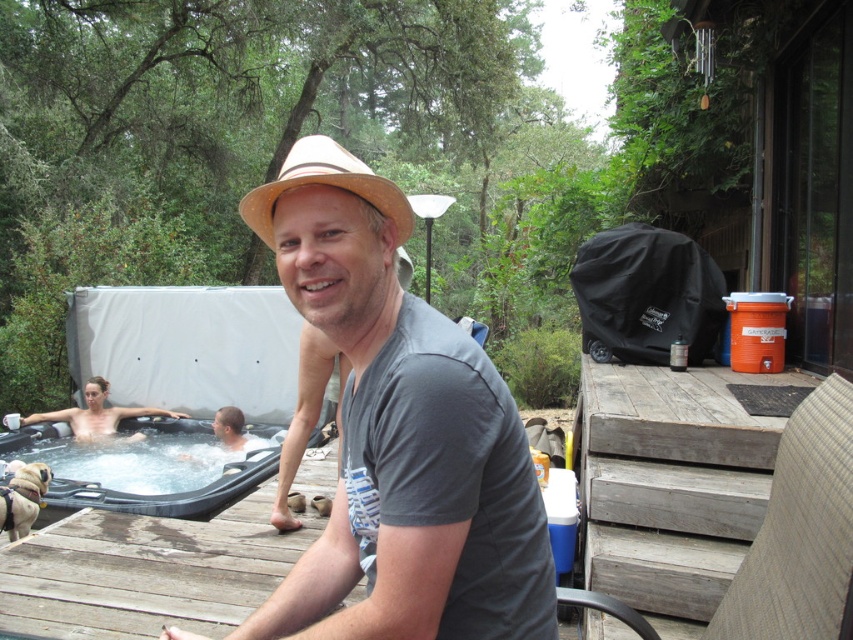
You are planning to place a large rectangular table that is 2 meters wide on the wooden deck. The deck has the wooden at center and the translucent plastic hot tub at lower left. Based on their widths, which object might be an issue for placing the table and why?

The translucent plastic hot tub at lower left has a greater width than the wooden at center. Since the table is 2 meters wide, the wooden at center may not be wide enough to accommodate it, while the translucent plastic hot tub at lower left might have sufficient space depending on its exact dimensions. However, the hot tub itself occupies space, so placement would need to avoid it.

You are a delivery person with a package that requires a 4 meter clearance path. You need to move from the weathered wood deck at right to the smooth skin woman at lower left. Can you safely navigate the space between them without needing to adjust your path?

The distance between the weathered wood deck at right and the smooth skin woman at lower left is 5.17 meters, which is greater than the required 4 meter clearance. Therefore, you can safely navigate the space without needing to adjust your path.